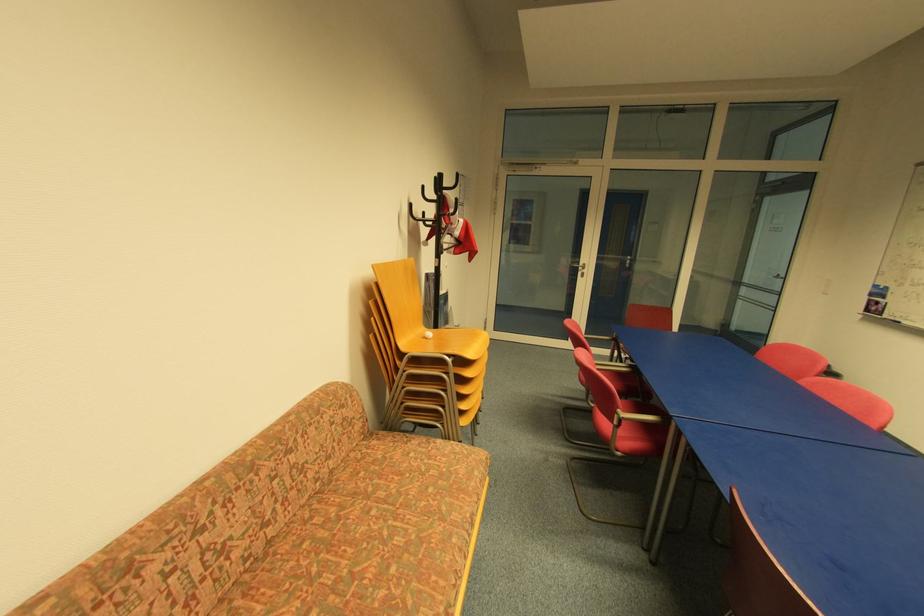
Where would you sit the red chair sitting surface? Please return your answer as a coordinate pair (x, y).

(627, 422)